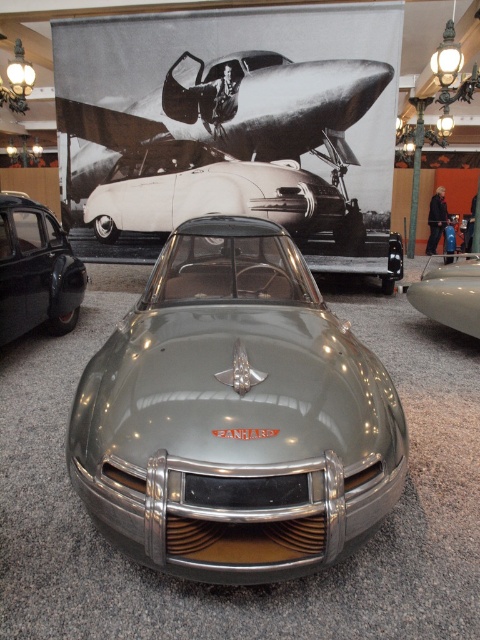
You are a photographer standing at the camera position in the image. You want to capture a closeup shot of the shiny silver airplane at upper center. Given that your camera has a minimum focusing distance of 5 meters, will you be able to take the photo without moving closer?

The shiny silver airplane at upper center is 7.17 meters away from the camera. Since the minimum focusing distance is 5 meters, the photographer can take the closeup shot without moving closer because the airplane is beyond the minimum required distance.

You are a photographer standing at the entrance of the exhibition. You want to take a photo that includes both the shiny silver airplane at upper center and the matte black car at lower left. What is the minimum distance you need to move backward to ensure both objects are in frame?

The shiny silver airplane at upper center is 2.99 meters away from the matte black car at lower left. To capture both in a single frame, you need to move back at least 2.99 meters to ensure both are within the camera lens field of view.